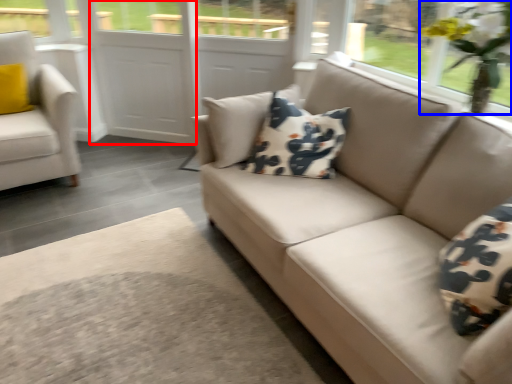
Question: Which of the following is the farthest to the observer, screen door (highlighted by a red box) or floral arrangement (highlighted by a blue box)?

Choices:
 (A) screen door
 (B) floral arrangement

Answer: (A)